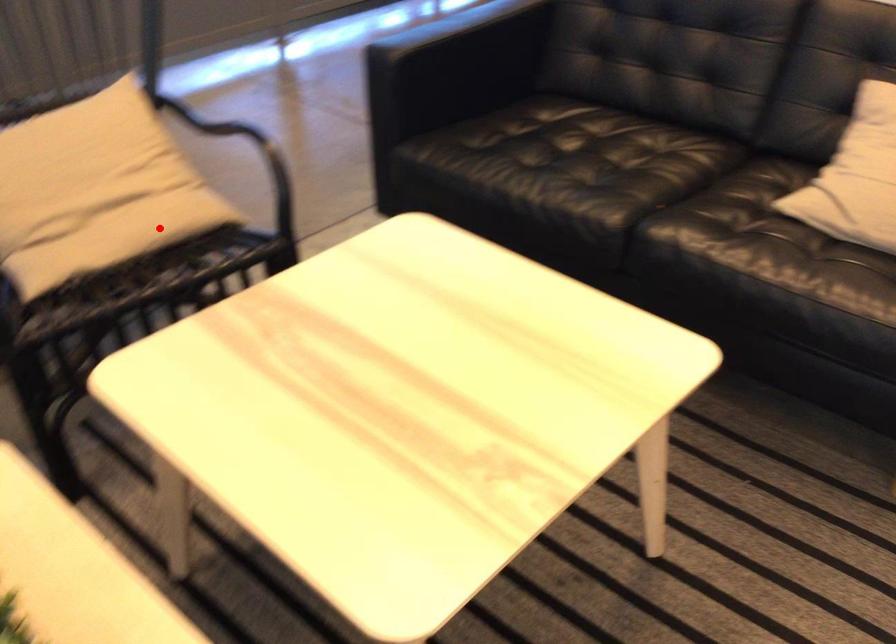
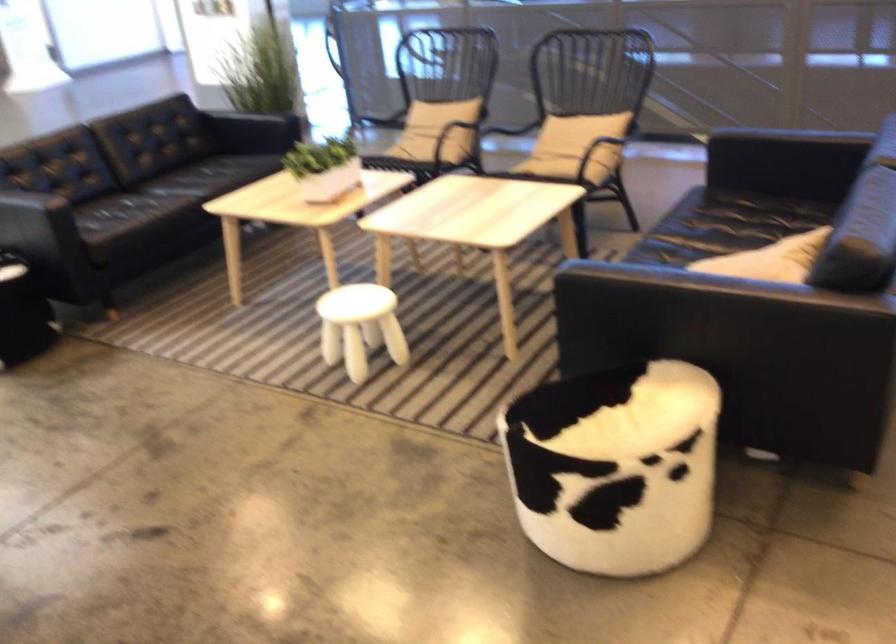
Question: I am providing you with two images of the same scene from different viewpoints. Image1 has a red point marked. In image2, the corresponding 3D location appears at what relative position? Reply with the corresponding letter.

Choices:
 (A) Closer
 (B) Farther

Answer: (B)